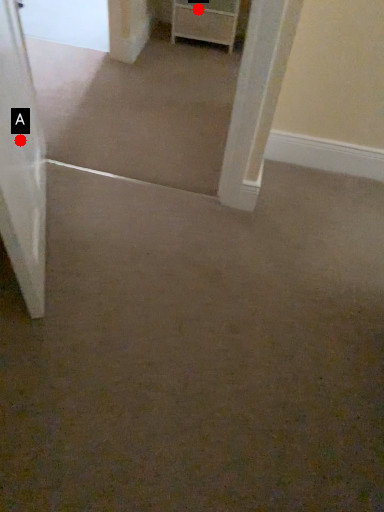
Question: Two points are circled on the image, labeled by A and B beside each circle. Among these points, which one is farthest from the camera?

Choices:
 (A) A is further
 (B) B is further

Answer: (B)